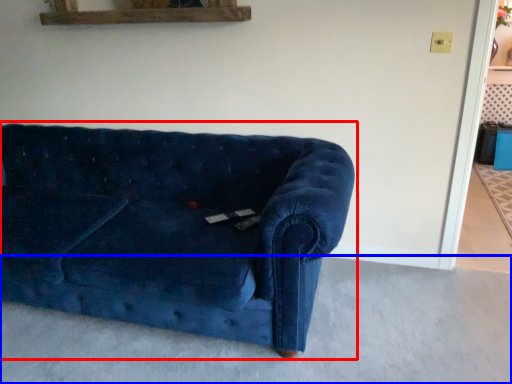
Question: Which object is closer to the camera taking this photo, studio couch (highlighted by a red box) or concrete (highlighted by a blue box)?

Choices:
 (A) studio couch
 (B) concrete

Answer: (B)